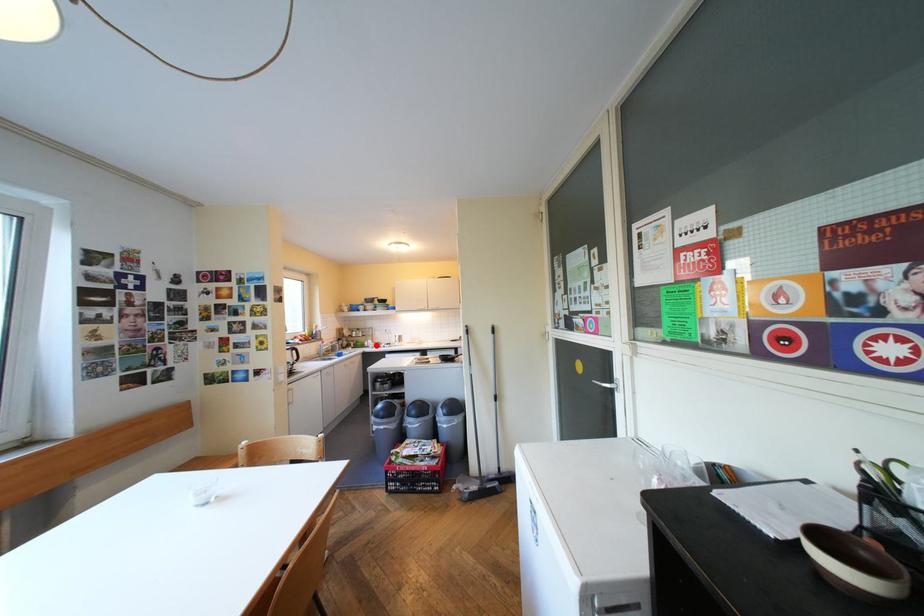
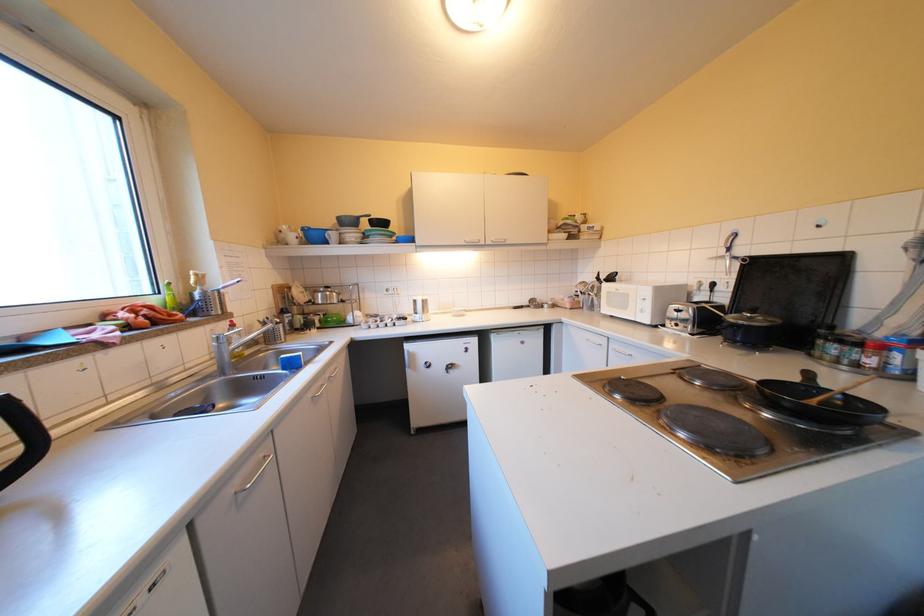
Question: A red point is marked in image1. In image2, is the corresponding 3D point closer to the camera or farther? Reply with the corresponding letter.

Choices:
 (A) The corresponding 3D point is closer.
 (B) The corresponding 3D point is farther.

Answer: (A)